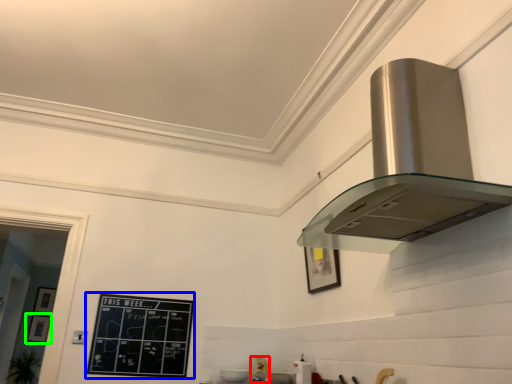
Question: Which object is the farthest from appliance (highlighted by a red box)? Choose among these: bulletin board (highlighted by a blue box) or picture frame (highlighted by a green box).

Choices:
 (A) bulletin board
 (B) picture frame

Answer: (B)